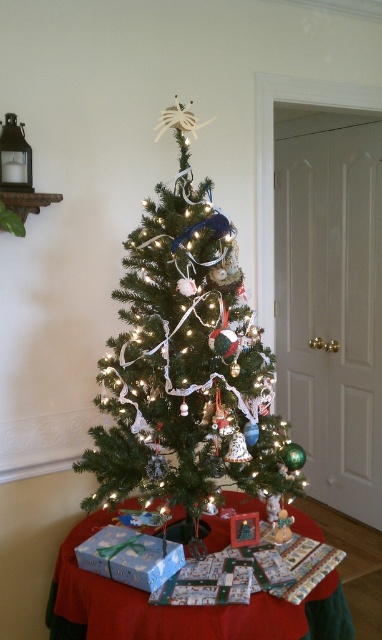
Question: Which of the following is the farthest from the observer?

Choices:
 (A) (119, 536)
 (B) (278, 611)
 (C) (189, 296)

Answer: (A)

Question: Which of the following is the closest to the observer?

Choices:
 (A) green matte christmas tree at center
 (B) wrapping paper at lower center

Answer: (B)

Question: Can you confirm if green matte christmas tree at center is positioned to the left of blue paper gift at lower left?

Choices:
 (A) yes
 (B) no

Answer: (B)

Question: Which point is farther to the camera?

Choices:
 (A) green matte christmas tree at center
 (B) wrapping paper at lower center

Answer: (A)

Question: Can you confirm if green matte christmas tree at center is wider than blue paper gift at lower left?

Choices:
 (A) yes
 (B) no

Answer: (A)

Question: Is wrapping paper at lower center to the left of blue paper gift at lower left from the viewer's perspective?

Choices:
 (A) yes
 (B) no

Answer: (B)